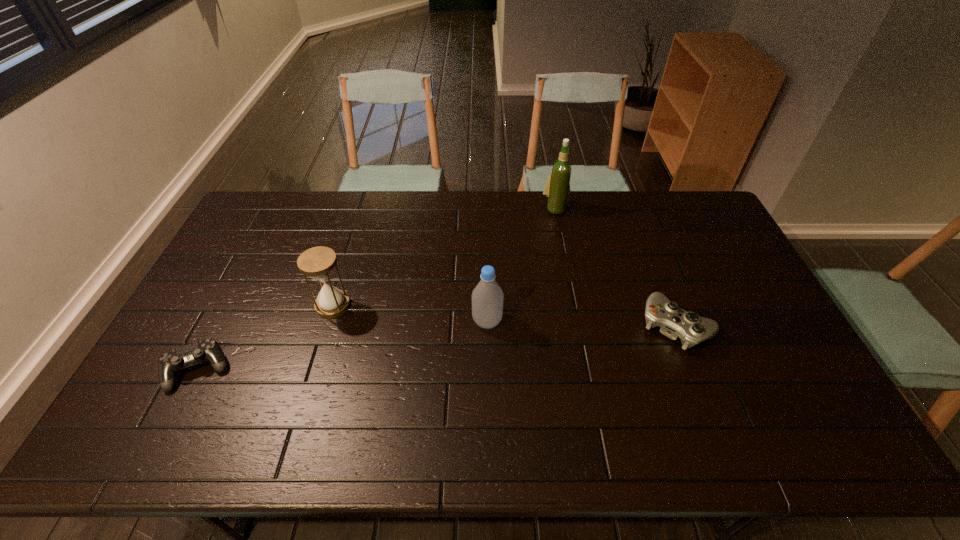
Find the location of `free space located on the right of the second object from left to right`. free space located on the right of the second object from left to right is located at coordinates (483, 305).

Where is `vacant region located on the right of the taller control`? vacant region located on the right of the taller control is located at coordinates (769, 326).

At what (x,y) coordinates should I click in order to perform the action: click on vacant space positioned 0.180m on the right of the leftmost object. Please return your answer as a coordinate pair (x, y). Image resolution: width=960 pixels, height=540 pixels. Looking at the image, I should click on (297, 369).

I want to click on object that is positioned at the far edge, so click(x=557, y=188).

The width and height of the screenshot is (960, 540). I want to click on object located at the left edge, so click(169, 363).

The image size is (960, 540). Find the location of `vacant space at the far edge of the desktop`. vacant space at the far edge of the desktop is located at coordinates (590, 201).

I want to click on vacant region at the near edge of the desktop, so click(221, 443).

The width and height of the screenshot is (960, 540). In the image, there is a desktop. Identify the location of free region at the left edge. (246, 238).

Where is `free point at the right edge`? The width and height of the screenshot is (960, 540). free point at the right edge is located at coordinates (741, 295).

Where is `vacant space at the far left corner of the desktop`? The image size is (960, 540). vacant space at the far left corner of the desktop is located at coordinates (260, 194).